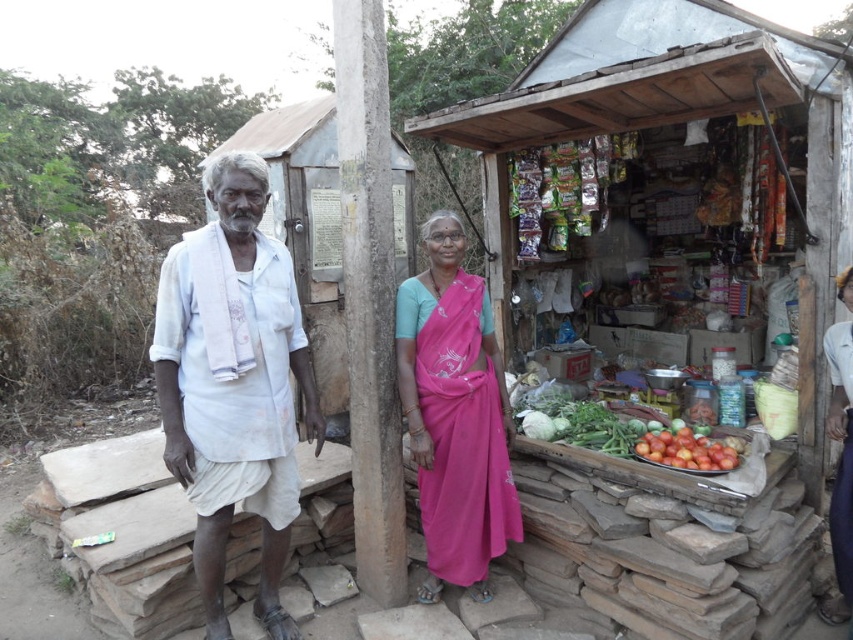
Question: Does white cotton shirt at center appear under pink silk saree at center?

Choices:
 (A) no
 (B) yes

Answer: (A)

Question: Based on their relative distances, which object is farther from the white cotton shirt at center?

Choices:
 (A) pink silk saree at center
 (B) shiny red tomatoes at center

Answer: (B)

Question: Is white cotton shirt at center smaller than pink silk saree at center?

Choices:
 (A) no
 (B) yes

Answer: (A)

Question: Is white cotton shirt at left below pink silk saree at center?

Choices:
 (A) no
 (B) yes

Answer: (A)

Question: Which object appears farthest from the camera in this image?

Choices:
 (A) white cotton shirt at left
 (B) pink silk saree at center

Answer: (B)

Question: Estimate the real-world distances between objects in this image. Which object is farther from the shiny red tomatoes at center?

Choices:
 (A) white cotton shirt at left
 (B) pink silk saree at center

Answer: (A)